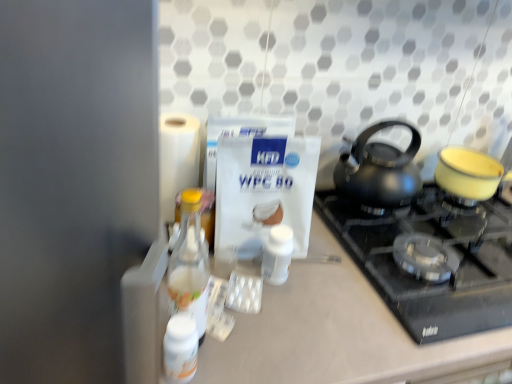
Locate an element on the screen. The image size is (512, 384). vacant space behind white glossy bottle at lower left, the second bottle positioned from the front is located at coordinates (234, 304).